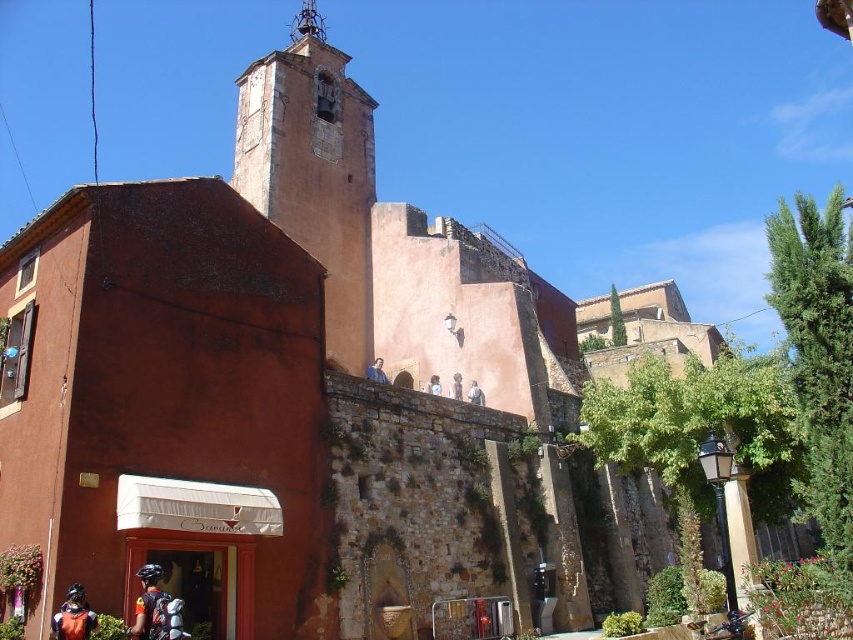
Question: Considering the relative positions of smooth skin face at upper center and white fabric person at upper center in the image provided, where is smooth skin face at upper center located with respect to white fabric person at upper center?

Choices:
 (A) above
 (B) below

Answer: (A)

Question: Is shiny metallic motorcycle at lower left above light blue fabric at upper center?

Choices:
 (A) yes
 (B) no

Answer: (B)

Question: Which object is the closest to the shiny blue helmet at lower left?

Choices:
 (A) smooth skin face at upper center
 (B) white fabric person at upper center
 (C) matte gray statue at upper center
 (D) orange stucco tower at upper center

Answer: (A)

Question: Which point is closer to the camera taking this photo?

Choices:
 (A) (450, 394)
 (B) (245, 124)
 (C) (477, 394)

Answer: (C)

Question: Which object is the closest to the shiny blue helmet at lower left?

Choices:
 (A) smooth skin face at upper center
 (B) orange stucco tower at upper center

Answer: (A)

Question: Can you confirm if orange stucco tower at upper center is smaller than orange fabric helmet at lower left?

Choices:
 (A) no
 (B) yes

Answer: (A)